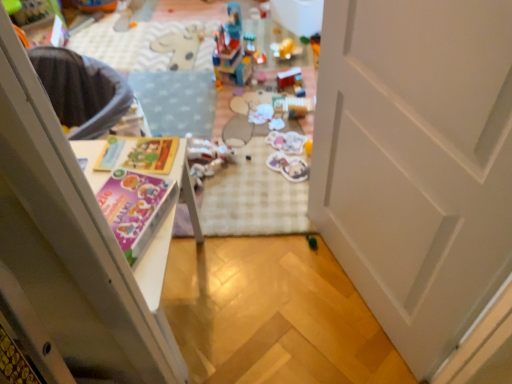
Find the location of `vacant space that's between matte plastic stickers at center, the second toy from the bottom, and brick-like plastic toy at center, which appears as the first toy when viewed from the top`. vacant space that's between matte plastic stickers at center, the second toy from the bottom, and brick-like plastic toy at center, which appears as the first toy when viewed from the top is located at coordinates (260, 119).